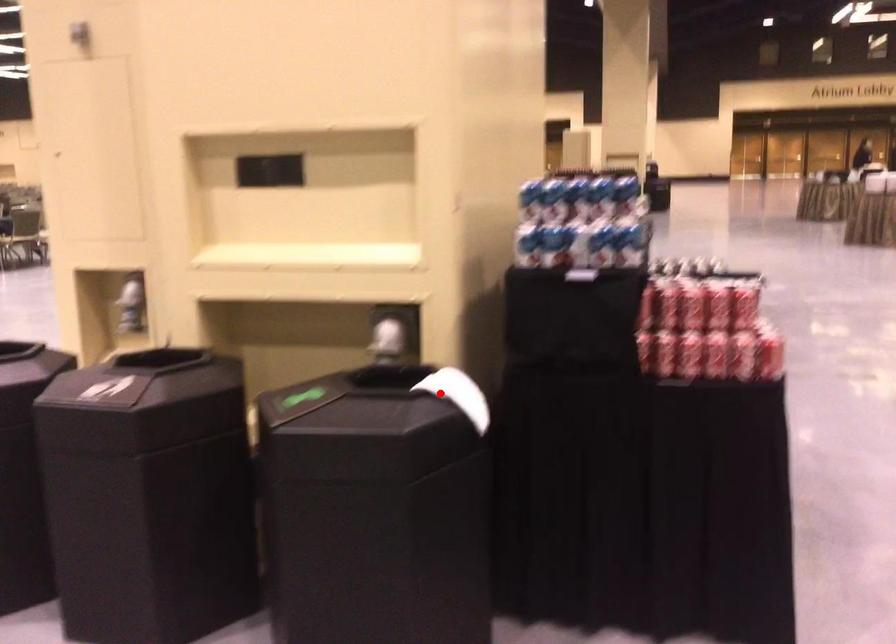
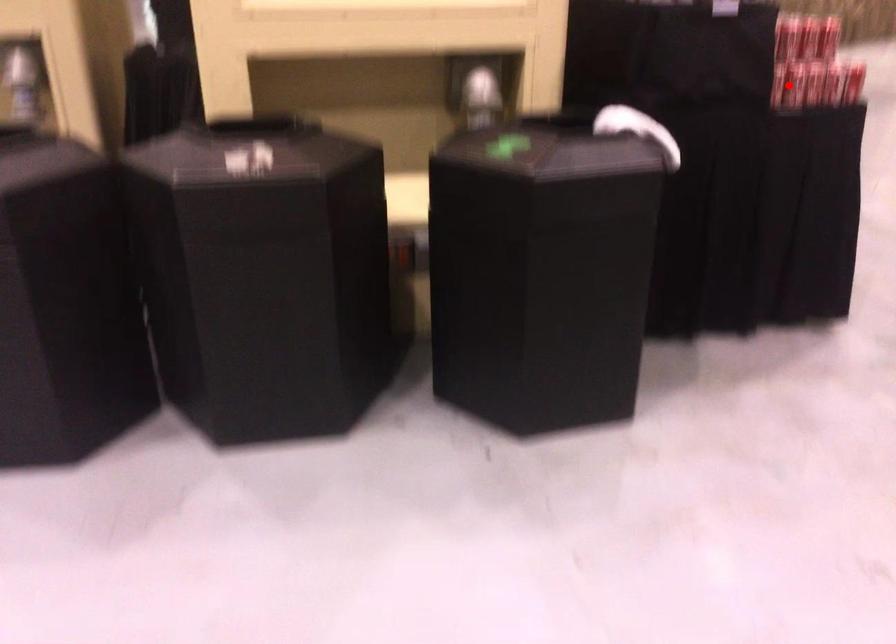
I am providing you with two images of the same scene from different viewpoints. A red point is marked on the first image and another point is marked on the second image. Are the points marked in image1 and image2 representing the same 3D position?

No